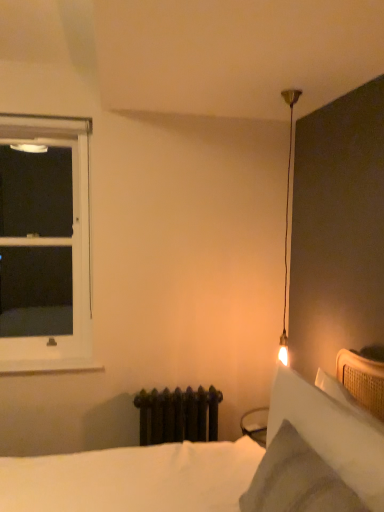
Question: Is white soft bed at lower right outside of white matte window sill at lower left?

Choices:
 (A) no
 (B) yes

Answer: (B)

Question: Could white matte window sill at lower left be considered to be inside white soft bed at lower right?

Choices:
 (A) no
 (B) yes

Answer: (A)

Question: Considering the relative positions of white soft bed at lower right and white matte window sill at lower left in the image provided, is white soft bed at lower right in front of white matte window sill at lower left?

Choices:
 (A) yes
 (B) no

Answer: (A)

Question: Is white soft bed at lower right far from white matte window sill at lower left?

Choices:
 (A) no
 (B) yes

Answer: (A)

Question: From the image's perspective, is white soft bed at lower right beneath white matte window sill at lower left?

Choices:
 (A) yes
 (B) no

Answer: (A)

Question: Does point (8, 367) appear closer or farther from the camera than point (367, 441)?

Choices:
 (A) farther
 (B) closer

Answer: (A)

Question: Is white matte window sill at lower left in front of or behind white soft bed at lower right in the image?

Choices:
 (A) behind
 (B) front

Answer: (A)

Question: Is white matte window sill at lower left taller or shorter than white soft bed at lower right?

Choices:
 (A) tall
 (B) short

Answer: (B)

Question: From a real-world perspective, is white matte window sill at lower left positioned above or below white soft bed at lower right?

Choices:
 (A) below
 (B) above

Answer: (A)

Question: From the image's perspective, is white soft bed at lower right positioned above or below white soft pillow at upper right?

Choices:
 (A) above
 (B) below

Answer: (B)

Question: From a real-world perspective, is white soft bed at lower right positioned above or below white soft pillow at upper right?

Choices:
 (A) below
 (B) above

Answer: (A)

Question: In the image, is white soft bed at lower right positioned in front of or behind white soft pillow at upper right?

Choices:
 (A) front
 (B) behind

Answer: (A)

Question: Considering the positions of white soft bed at lower right and white soft pillow at upper right in the image, is white soft bed at lower right wider or thinner than white soft pillow at upper right?

Choices:
 (A) wide
 (B) thin

Answer: (A)

Question: From a real-world perspective, relative to white soft pillow at upper right, is white plastic window at left vertically above or below?

Choices:
 (A) below
 (B) above

Answer: (B)

Question: Considering the relative positions of white plastic window at left and white soft pillow at upper right in the image provided, is white plastic window at left to the left or to the right of white soft pillow at upper right?

Choices:
 (A) left
 (B) right

Answer: (A)